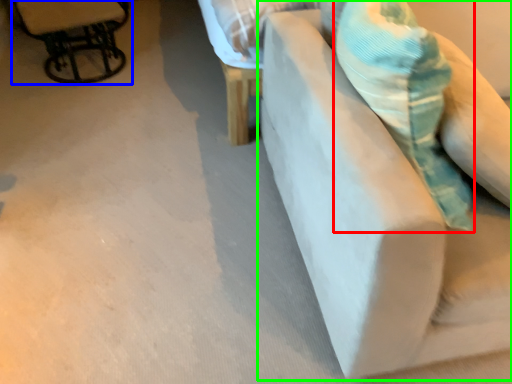
Question: Estimate the real-world distances between objects in this image. Which object is farther from throw pillow (highlighted by a red box), chair (highlighted by a blue box) or furniture (highlighted by a green box)?

Choices:
 (A) chair
 (B) furniture

Answer: (A)